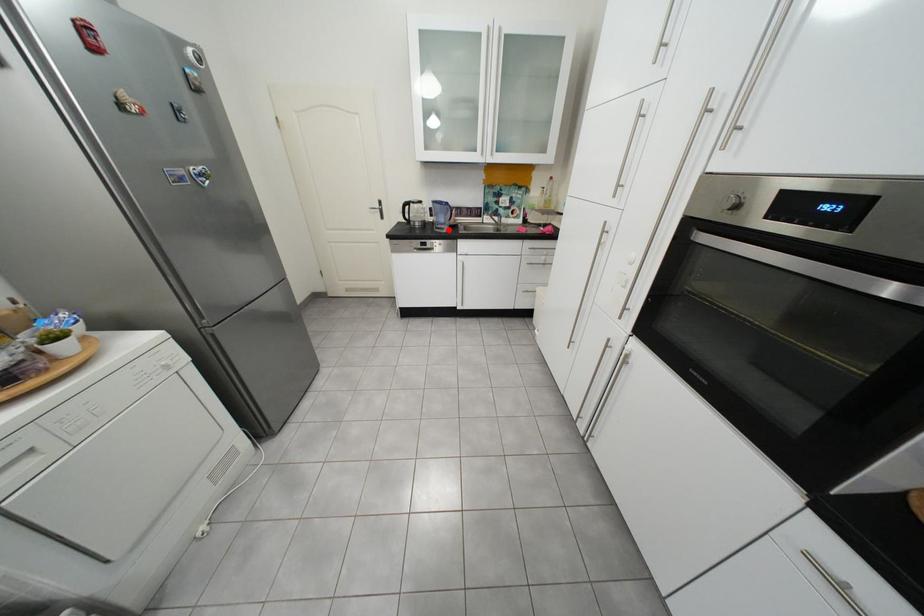
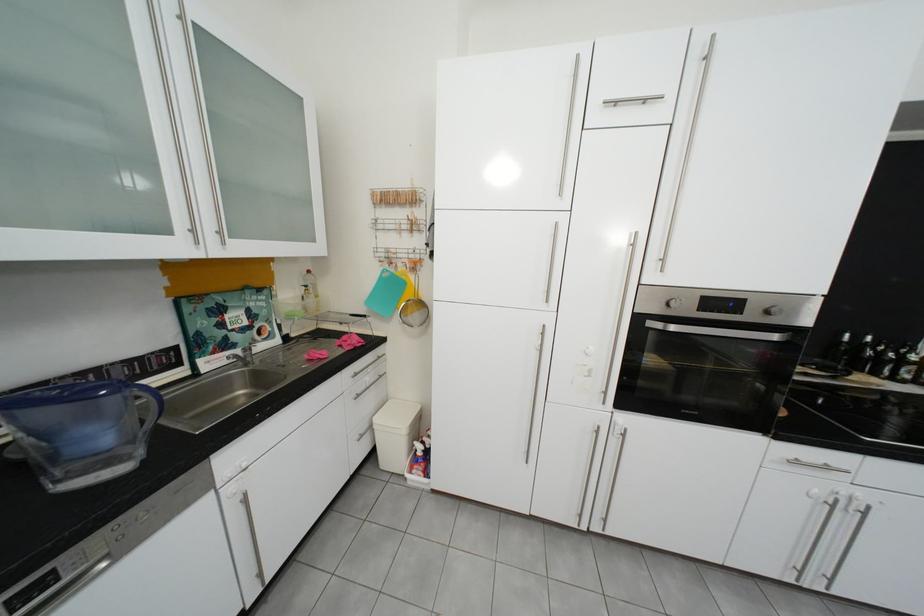
Question: I am providing you with two images of the same scene from different viewpoints. A red point is shown in image1. For the corresponding object point in image2, is it positioned nearer or farther from the camera?

Choices:
 (A) Nearer
 (B) Farther

Answer: (B)